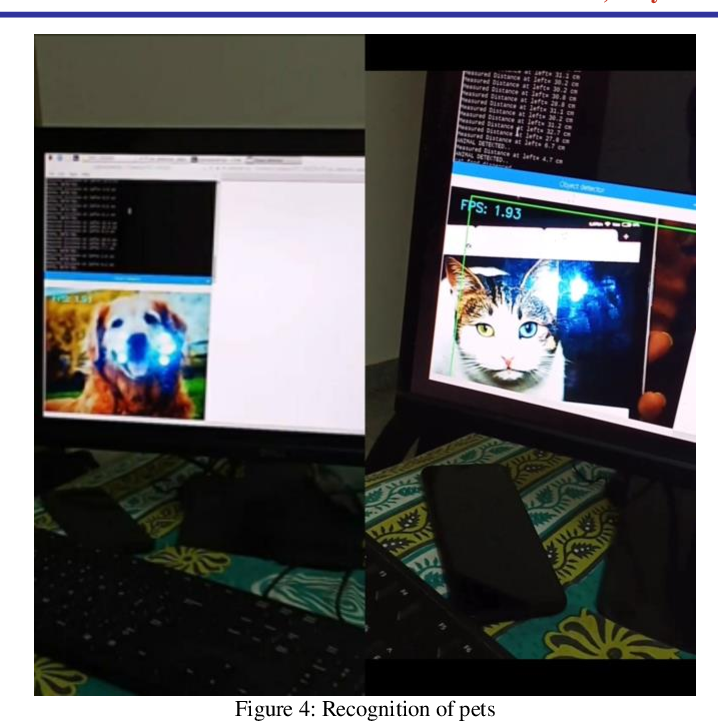
Find the location of a particular element. The image size is (718, 722). mouse pad is located at coordinates (568, 536).